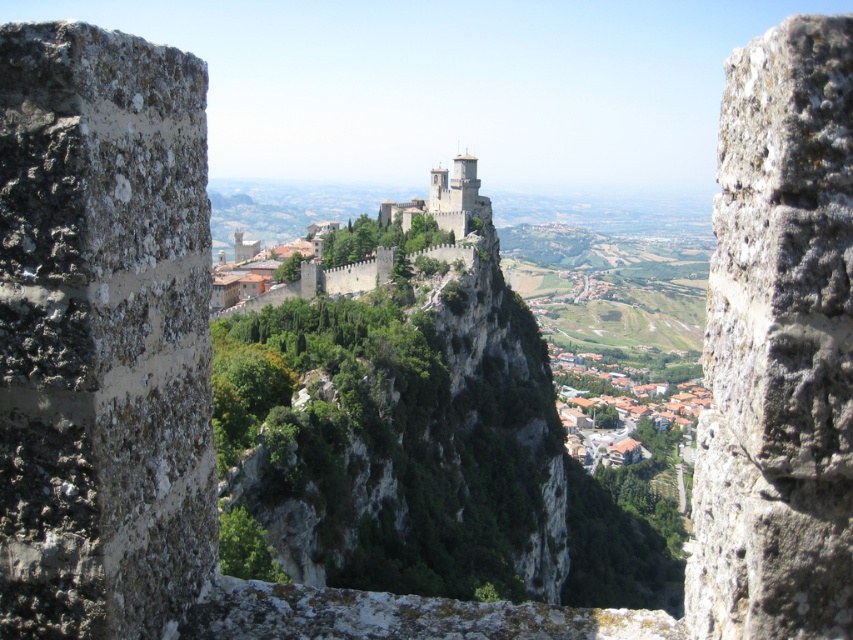
Between rough stone wall at center and stone medieval castle at center, which one appears on the right side from the viewer's perspective?

From the viewer's perspective, rough stone wall at center appears more on the right side.

Between rough stone wall at center and stone medieval castle at center, which one is positioned lower?

Positioned lower is rough stone wall at center.

The width and height of the screenshot is (853, 640). I want to click on rough stone wall at center, so click(779, 346).